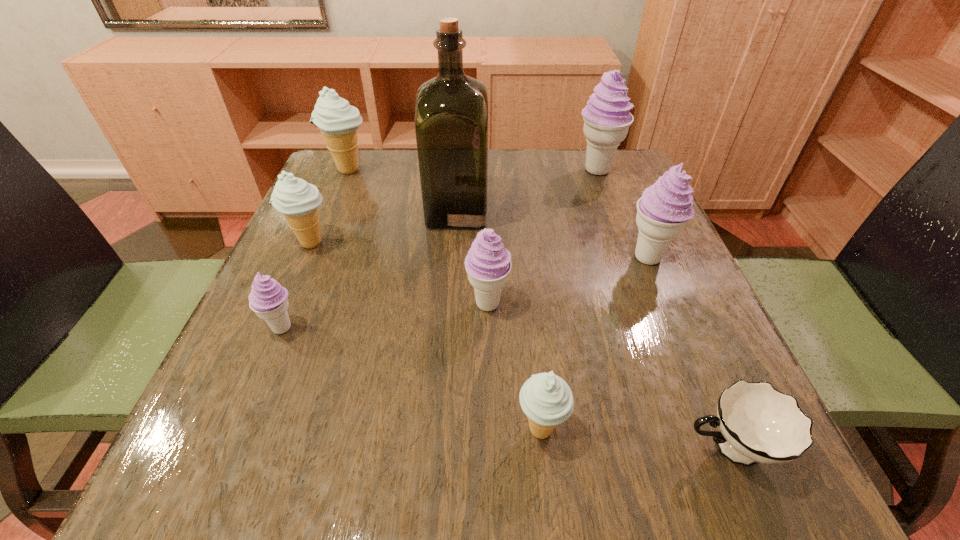
In the image, there is a desktop. At what (x,y) coordinates should I click in order to perform the action: click on free space at the far edge. Please return your answer as a coordinate pair (x, y). The image size is (960, 540). Looking at the image, I should click on (393, 192).

Where is `free region at the near edge`? This screenshot has height=540, width=960. free region at the near edge is located at coordinates (306, 471).

In the image, there is a desktop. Where is `vacant region at the left edge`? The height and width of the screenshot is (540, 960). vacant region at the left edge is located at coordinates (342, 203).

Identify the location of vacant area at the right edge of the desktop. The width and height of the screenshot is (960, 540). pos(662,281).

In the image, there is a desktop. At what (x,y) coordinates should I click in order to perform the action: click on vacant space at the far left corner. Please return your answer as a coordinate pair (x, y). Looking at the image, I should click on (368, 186).

You are a GUI agent. You are given a task and a screenshot of the screen. Output one action in this format:
    pyautogui.click(x=<x>, y=<y>)
    Task: Click on the free space at the near right corner
    
    Given the screenshot: What is the action you would take?
    pyautogui.click(x=779, y=477)

Locate an element on the screen. empty space between the smallest purple icecream and the second farthest beige icecream is located at coordinates (297, 286).

You are a GUI agent. You are given a task and a screenshot of the screen. Output one action in this format:
    pyautogui.click(x=<x>, y=<y>)
    Task: Click on the free space between the white cup and the second biggest purple icecream
    
    Given the screenshot: What is the action you would take?
    pyautogui.click(x=688, y=353)

In order to click on vacant area that lies between the third biggest purple icecream and the second farthest purple icecream in this screenshot , I will do `click(567, 281)`.

Identify the location of vacant space in between the nearest beige icecream and the second biggest beige icecream. click(426, 336).